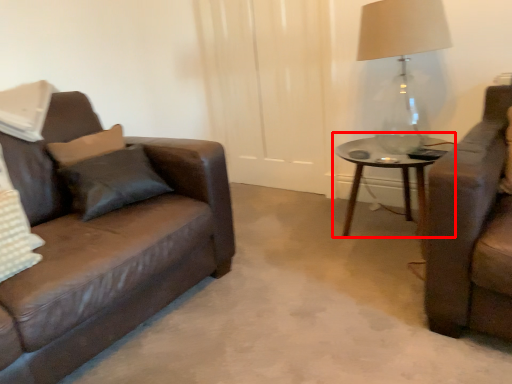
Question: From the image's perspective, where is coffee table (annotated by the red box) located in relation to table lamp in the image?

Choices:
 (A) below
 (B) above

Answer: (A)